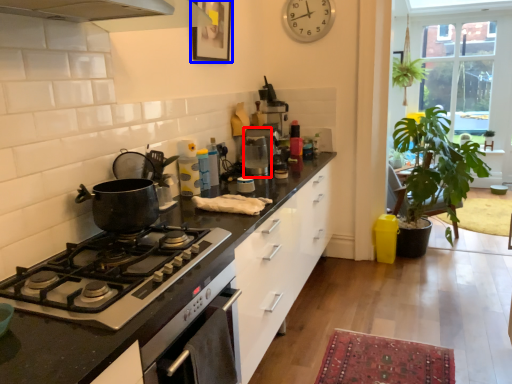
Question: Which object appears closest to the camera in this image, coffee machine (highlighted by a red box) or picture frame (highlighted by a blue box)?

Choices:
 (A) coffee machine
 (B) picture frame

Answer: (B)